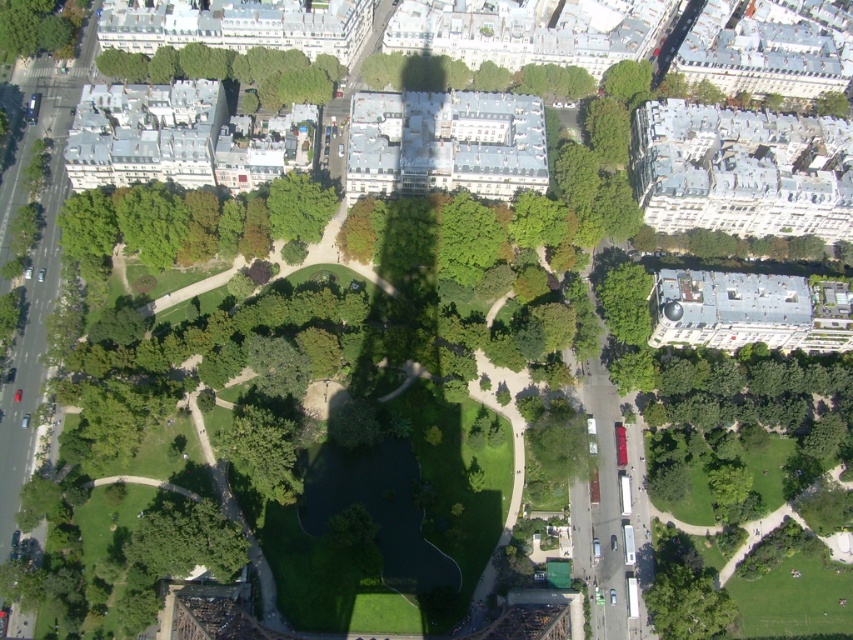
Question: Can you confirm if green leafy trees at upper left is smaller than green leafy tree at upper left?

Choices:
 (A) no
 (B) yes

Answer: (A)

Question: Estimate the real-world distances between objects in this image. Which object is farther from the green leafy trees at upper left?

Choices:
 (A) green leafy trees at center
 (B) green leafy tree at upper left

Answer: (A)

Question: Can you confirm if green leafy trees at upper left is wider than green leafy tree at upper left?

Choices:
 (A) yes
 (B) no

Answer: (A)

Question: Which point appears closest to the camera in this image?

Choices:
 (A) (264, 64)
 (B) (9, 26)
 (C) (71, 205)

Answer: (C)

Question: Among these objects, which one is nearest to the camera?

Choices:
 (A) green leafy trees at center
 (B) green leafy tree at upper left

Answer: (A)

Question: In this image, where is green leafy trees at center located relative to green leafy trees at upper left?

Choices:
 (A) left
 (B) right

Answer: (B)